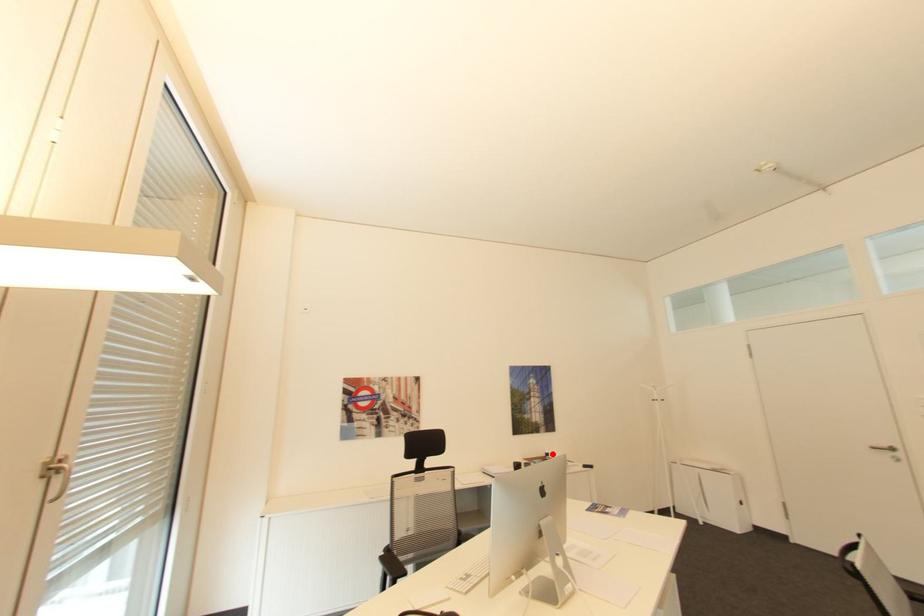
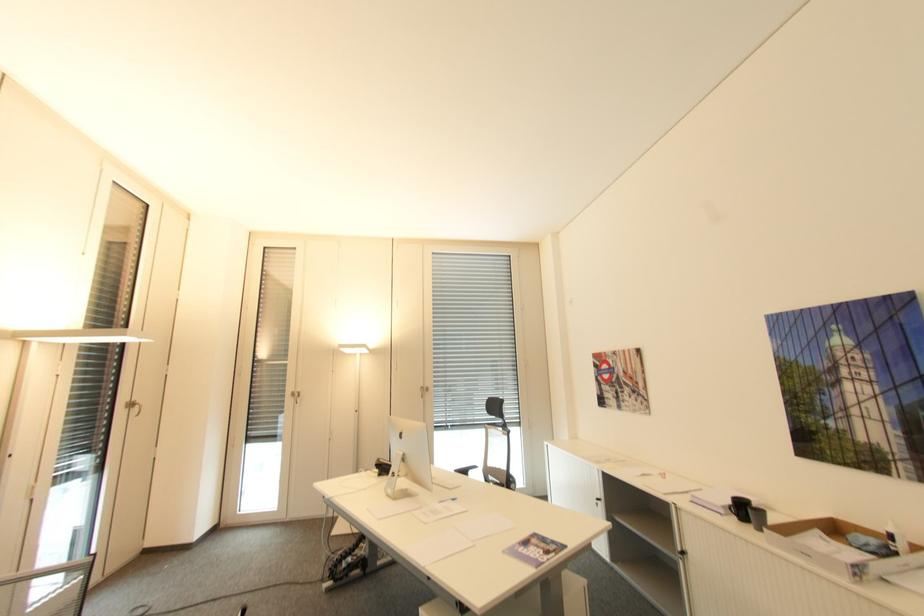
Locate, in the second image, the point that corresponds to the highlighted location in the first image.

(895, 537)